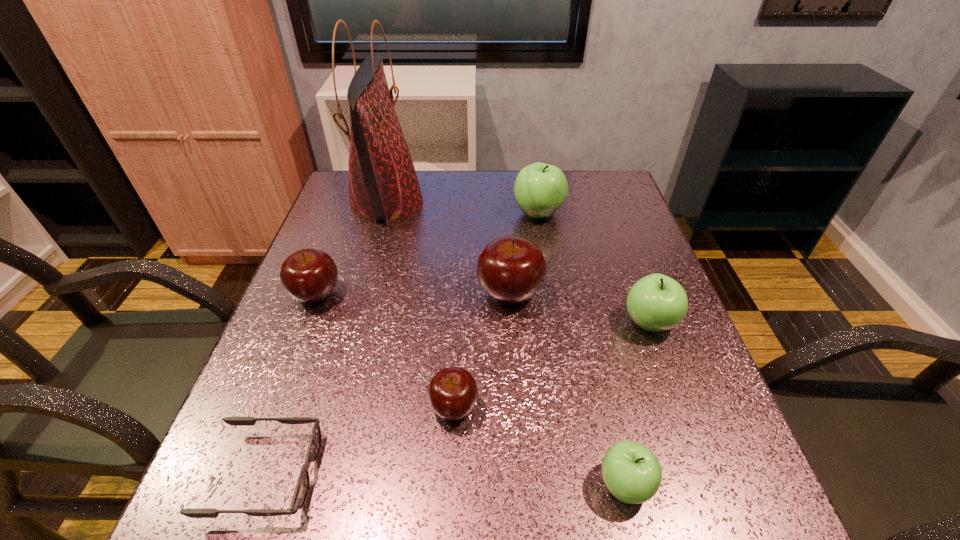
Identify which green apple is the third nearest to the tallest object. Please provide its 2D coordinates. Your answer should be formatted as a tuple, i.e. [(x, y)], where the tuple contains the x and y coordinates of a point satisfying the conditions above.

[(632, 473)]

I want to click on red apple that is the closest to the second biggest red apple, so click(x=452, y=393).

Where is `red apple object that ranks as the closest to the smallest red apple`? This screenshot has height=540, width=960. red apple object that ranks as the closest to the smallest red apple is located at coordinates (510, 269).

Where is `free space that satisfies the following two spatial constraints: 1. on the front side of the biggest green apple; 2. on the left side of the nearest green apple`? The width and height of the screenshot is (960, 540). free space that satisfies the following two spatial constraints: 1. on the front side of the biggest green apple; 2. on the left side of the nearest green apple is located at coordinates (584, 484).